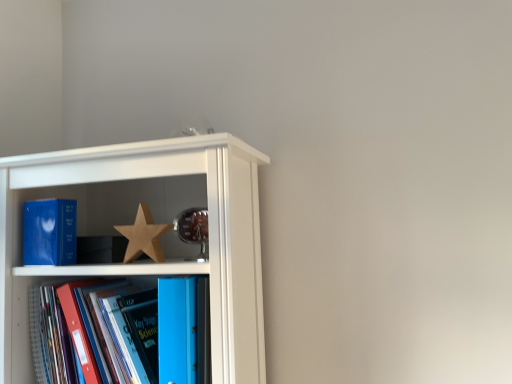
Question: Is blue matte book at left, arranged as the 3th book when viewed from the right, in front of or behind matte wooden shelf at upper left in the image?

Choices:
 (A) behind
 (B) front

Answer: (A)

Question: From a real-world perspective, is blue matte book at left, arranged as the 3th book when viewed from the right, above or below matte wooden shelf at upper left?

Choices:
 (A) above
 (B) below

Answer: (A)

Question: Which object is the farthest from the matte wooden shelf at upper left?

Choices:
 (A) blue glossy folder at lower left, which is counted as the 2th book, starting from the left
 (B) blue plastic folder at center, placed as the 3th book when sorted from left to right
 (C) wooden star at center
 (D) blue matte book at left, which ranks as the first book in left-to-right order

Answer: (D)

Question: Considering the real-world distances, which object is farthest from the matte wooden shelf at upper left?

Choices:
 (A) blue glossy folder at lower left, marked as the second book in a right-to-left arrangement
 (B) blue matte book at left, arranged as the 3th book when viewed from the right
 (C) blue plastic folder at center, which ranks as the 1th book in right-to-left order
 (D) wooden star at center

Answer: (B)